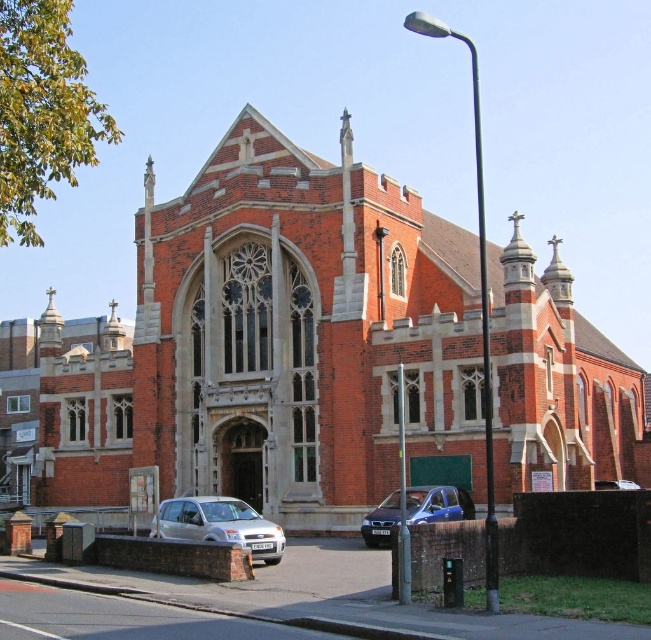
Based on the scene description, what is located at the coordinates point (273, 346)?

The red brick church at center is located at point (273, 346).

You are a delivery driver who needs to park your truck, which is 10 meters long, between the silver metallic hatchback at lower left and the metallic blue car at lower center. Can you fit your truck in that space?

The distance between the silver metallic hatchback at lower left and the metallic blue car at lower center is 9.13 meters. Since your truck is 10 meters long, it cannot fit in the available space.